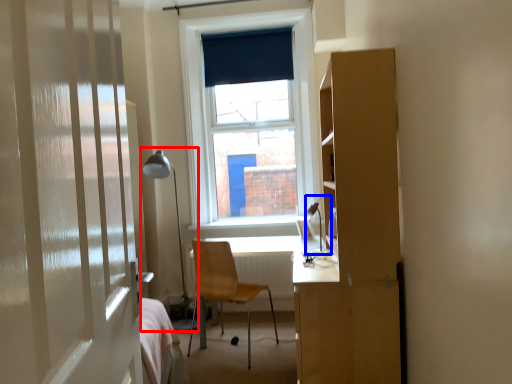
Question: Which point is further to the camera, table lamp (highlighted by a red box) or table lamp (highlighted by a blue box)?

Choices:
 (A) table lamp
 (B) table lamp

Answer: (A)